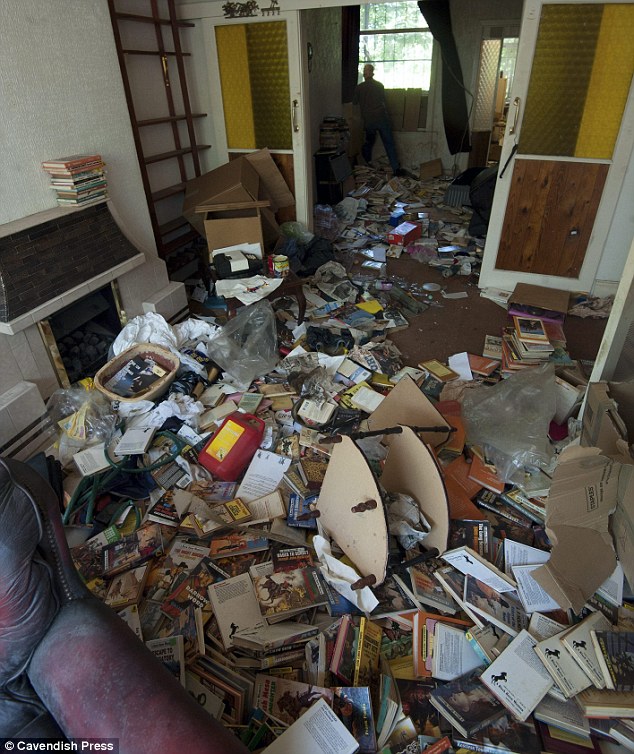
Where is `sliding doors`? sliding doors is located at coordinates pos(539,179), pos(283,157).